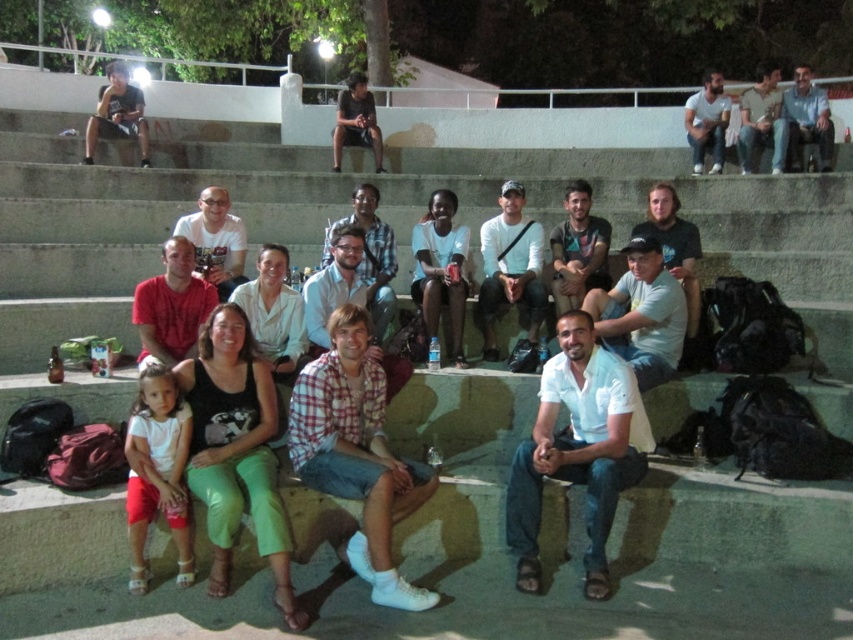
You are a GUI agent. You are given a task and a screenshot of the screen. Output one action in this format:
    pyautogui.click(x=<x>, y=<y>)
    Task: Click on the matte white shirt at center
    Image resolution: width=853 pixels, height=640 pixels.
    Given the screenshot: What is the action you would take?
    pyautogui.click(x=584, y=438)

Can you confirm if matte white shirt at center is thinner than light blue jeans at upper right?

No, matte white shirt at center is not thinner than light blue jeans at upper right.

What do you see at coordinates (584, 438) in the screenshot? I see `matte white shirt at center` at bounding box center [584, 438].

Image resolution: width=853 pixels, height=640 pixels. I want to click on matte white shirt at center, so click(x=584, y=438).